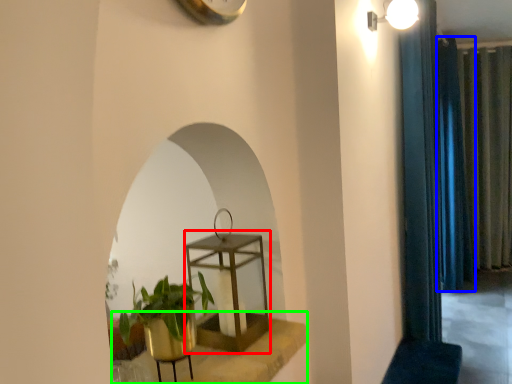
Question: Based on their relative distances, which object is nearer to round table (highlighted by a red box)? Choose from curtain (highlighted by a blue box) and window sill (highlighted by a green box).

Choices:
 (A) curtain
 (B) window sill

Answer: (B)